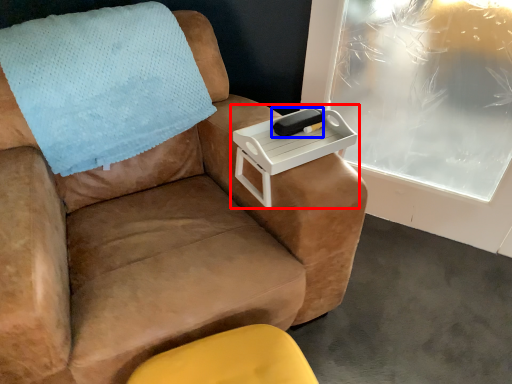
Question: Which point is further to the camera, table (highlighted by a red box) or pad (highlighted by a blue box)?

Choices:
 (A) table
 (B) pad

Answer: (B)